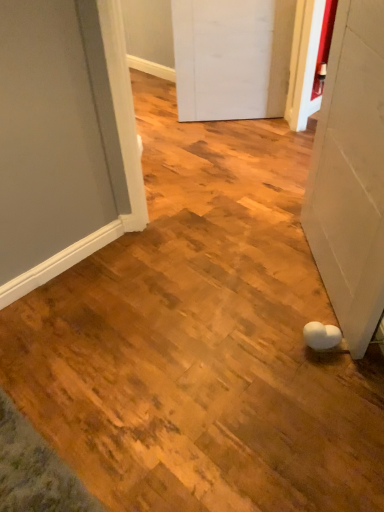
Question: Which direction should I rotate to look at white matte door at center, which is the 2th door in front-to-back order, — up or down?

Choices:
 (A) up
 (B) down

Answer: (A)

Question: Does white matte door at lower right, which is the second door from top to bottom, have a lesser width compared to white matte door at center, which is the 2th door in front-to-back order?

Choices:
 (A) no
 (B) yes

Answer: (A)

Question: Could white matte door at center, which ranks as the 2th door in bottom-to-top order, be considered to be inside white matte door at lower right, the 1th door from the front?

Choices:
 (A) no
 (B) yes

Answer: (A)

Question: Does white matte door at lower right, which is the second door from top to bottom, have a greater width compared to white matte door at center, the first door when ordered from back to front?

Choices:
 (A) yes
 (B) no

Answer: (A)

Question: Is white matte door at lower right, the 1th door from the front, taller than white matte door at center, the first door when ordered from back to front?

Choices:
 (A) no
 (B) yes

Answer: (B)

Question: Is white matte door at lower right, the 1th door from the front, not within white matte door at center, which ranks as the 2th door in bottom-to-top order?

Choices:
 (A) no
 (B) yes

Answer: (B)

Question: Does white matte door at lower right, which is the second door from top to bottom, appear on the right side of white matte door at center, marked as the first door in a top-to-bottom arrangement?

Choices:
 (A) yes
 (B) no

Answer: (A)

Question: Is white matte door at lower right, the 1th door from the front, a part of white matte door at center, which ranks as the 2th door in bottom-to-top order?

Choices:
 (A) yes
 (B) no

Answer: (B)

Question: Can you confirm if white matte door at center, which is the 2th door in front-to-back order, is wider than white matte door at lower right, acting as the first door starting from the bottom?

Choices:
 (A) no
 (B) yes

Answer: (A)

Question: From the image's perspective, would you say white matte door at center, which is the 2th door in front-to-back order, is positioned over white matte door at lower right, acting as the first door starting from the bottom?

Choices:
 (A) yes
 (B) no

Answer: (A)

Question: Is white matte door at center, the first door when ordered from back to front, far from white matte door at lower right, which is the second door from top to bottom?

Choices:
 (A) no
 (B) yes

Answer: (B)

Question: Is white matte door at center, marked as the first door in a top-to-bottom arrangement, in contact with white matte door at lower right, which is the second door from top to bottom?

Choices:
 (A) no
 (B) yes

Answer: (A)

Question: Does white matte door at center, the first door when ordered from back to front, appear on the left side of white matte door at lower right, which is the second door from top to bottom?

Choices:
 (A) no
 (B) yes

Answer: (B)

Question: Is white matte door at lower right, acting as the first door starting from the bottom, taller or shorter than white matte door at center, marked as the first door in a top-to-bottom arrangement?

Choices:
 (A) short
 (B) tall

Answer: (B)